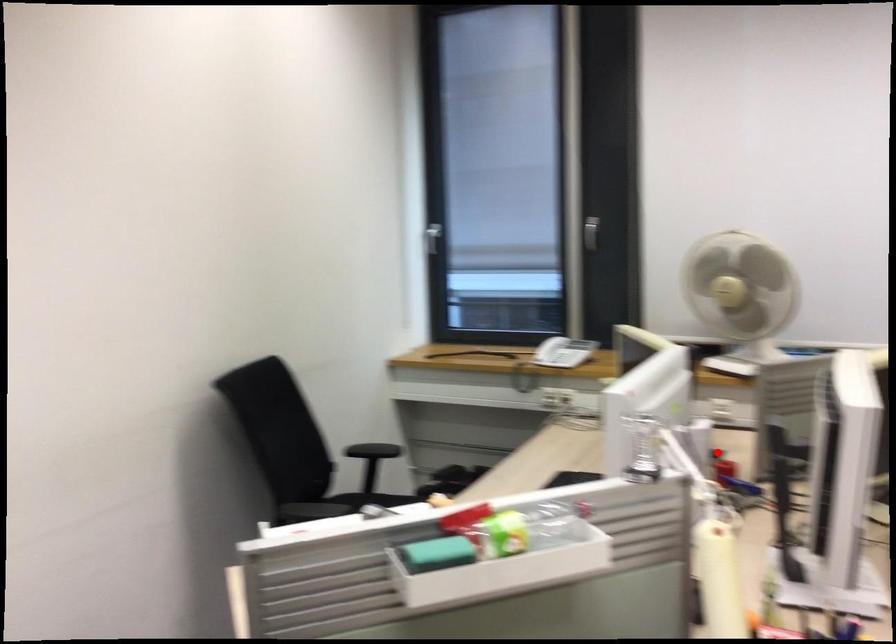
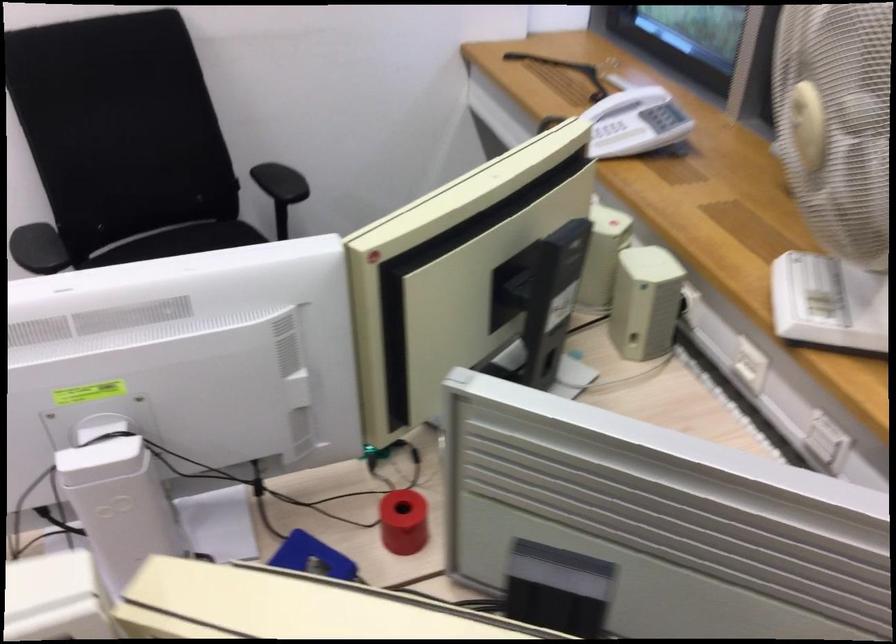
The point at the highlighted location is marked in the first image. Where is the corresponding point in the second image?

(403, 522)